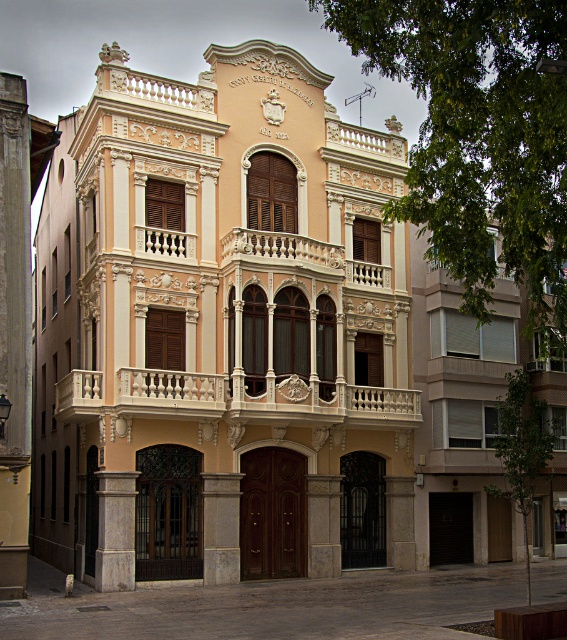
You are standing in front of the building and want to take a photo that includes both the white stone column at lower left and the smooth stone pillar at center. Which object should you position closer to the camera to ensure both are visible in the frame?

You should position the white stone column at lower left closer to the camera because it is already in front of the smooth stone pillar at center, so adjusting its position will help both appear in the frame.

You are standing in front of the classical building and want to take a photo. You notice two points on the building facade marked as point 1 at coordinates (109, 536) and point 2 at coordinates (239, 538). Which point is closer to your camera?

Point 1 at coordinates (109, 536) is closer to the camera than point 2 at coordinates (239, 538).

Consider the image. You are an architect assessing the building facade. You need to determine which object, the white marble balcony at center or the gray stone pillar at center, is taller. Based on the building description, which one is taller?

The white marble balcony at center has a greater height compared to the gray stone pillar at center, so the white marble balcony at center is taller.